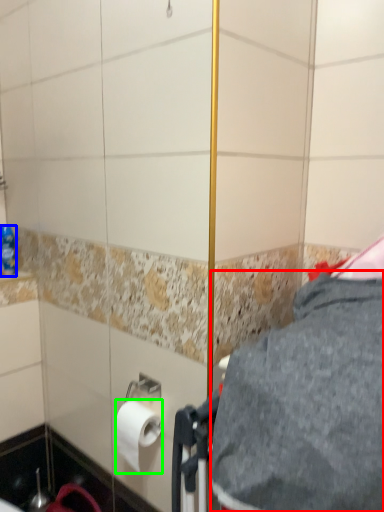
Question: Which object is the farthest from gray (highlighted by a red box)? Choose among these: bottle (highlighted by a blue box) or toilet paper (highlighted by a green box).

Choices:
 (A) bottle
 (B) toilet paper

Answer: (A)